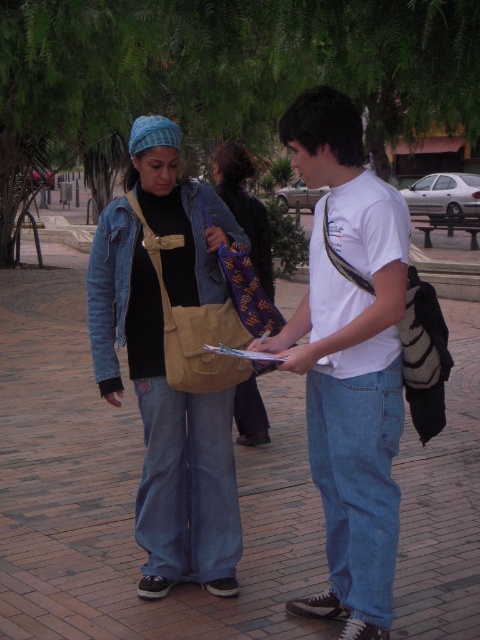
Question: Which point appears farthest from the camera in this image?

Choices:
 (A) (108, 310)
 (B) (241, 220)
 (C) (11, 440)
 (D) (349, 173)

Answer: (C)

Question: Which point appears farthest from the camera in this image?

Choices:
 (A) (436, 118)
 (B) (338, 163)
 (C) (181, 218)
 (D) (251, 250)

Answer: (A)

Question: Which object appears closest to the camera in this image?

Choices:
 (A) denim jacket at center
 (B) green leafy tree at upper center

Answer: (B)

Question: Is brick pavement at center positioned in front of matte beige bag at center?

Choices:
 (A) yes
 (B) no

Answer: (B)

Question: Does white matte t-shirt at center come in front of matte beige bag at center?

Choices:
 (A) no
 (B) yes

Answer: (B)

Question: Does tan suede bag at center have a greater width compared to denim jacket at center?

Choices:
 (A) no
 (B) yes

Answer: (B)